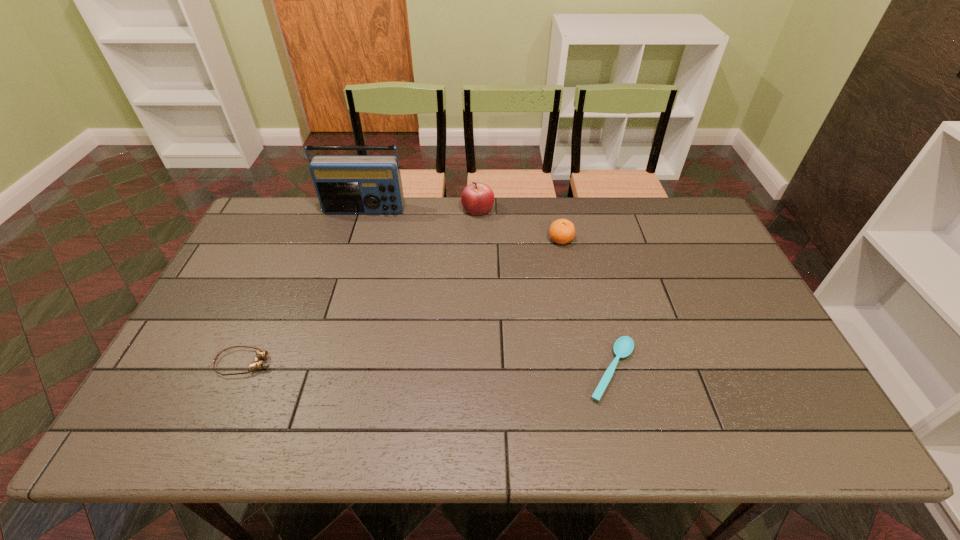
This screenshot has width=960, height=540. In the image, there is a desktop. Identify the location of vacant space at the far right corner. (660, 207).

Locate an element on the screen. vacant space at the near right corner is located at coordinates (815, 420).

The height and width of the screenshot is (540, 960). In order to click on free area in between the tallest object and the spoon in this screenshot , I will do `click(488, 291)`.

This screenshot has width=960, height=540. Find the location of `free space between the fourth tallest object and the third object from left to right`. free space between the fourth tallest object and the third object from left to right is located at coordinates (361, 286).

The height and width of the screenshot is (540, 960). Find the location of `free spot between the fourth tallest object and the fourth shortest object`. free spot between the fourth tallest object and the fourth shortest object is located at coordinates (361, 286).

At what (x,y) coordinates should I click in order to perform the action: click on vacant area that lies between the second shortest object and the shortest object. Please return your answer as a coordinate pair (x, y). This screenshot has width=960, height=540. Looking at the image, I should click on [x=428, y=367].

This screenshot has width=960, height=540. Find the location of `vacant area that lies between the spoon and the fourth shortest object`. vacant area that lies between the spoon and the fourth shortest object is located at coordinates (544, 290).

Find the location of a particular element. The width and height of the screenshot is (960, 540). blank region between the fourth tallest object and the tallest object is located at coordinates (304, 287).

Identify the location of vacant area between the clementine and the shortest object. (587, 305).

This screenshot has width=960, height=540. Identify the location of vacant area that lies between the clementine and the shortest object. (587, 305).